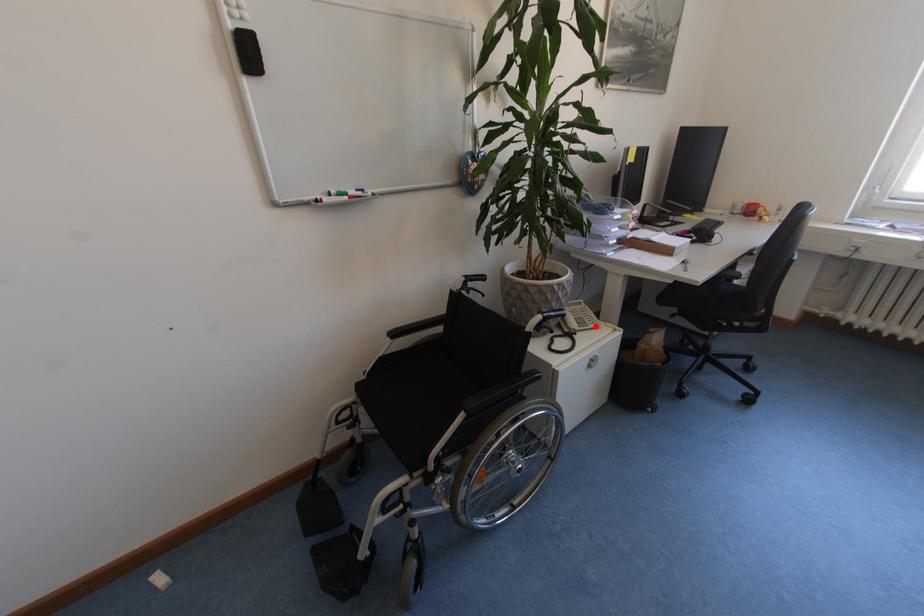
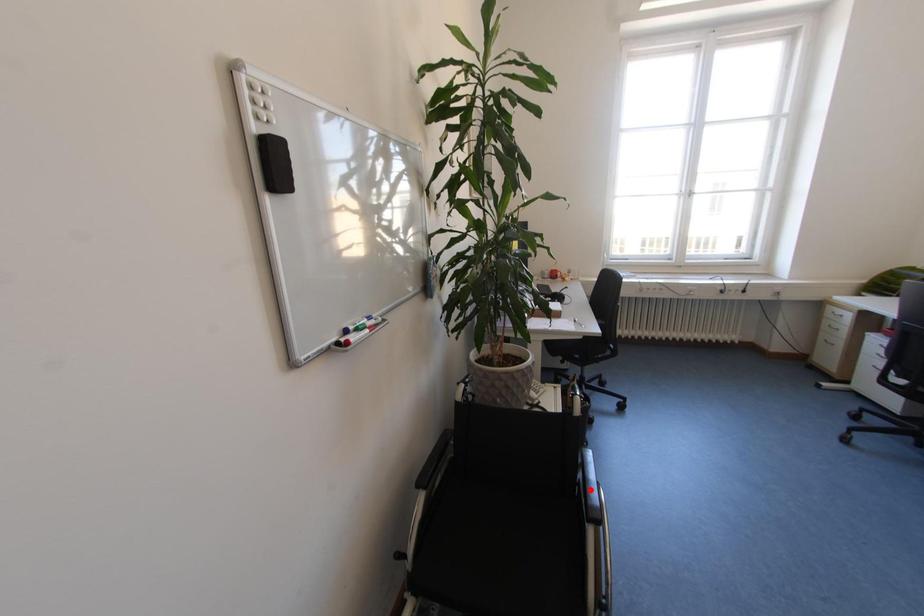
I am providing you with two images of the same scene from different viewpoints. A red point is marked on the first image and another point is marked on the second image. Do the highlighted points in image1 and image2 indicate the same real-world spot?

No